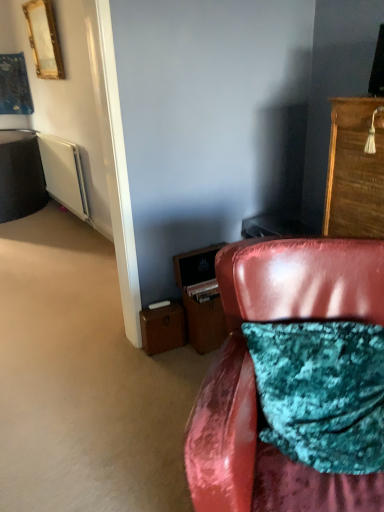
Question: Based on their sizes in the image, would you say gold-framed mirror at upper left is bigger or smaller than brown leather file cabinet at lower center?

Choices:
 (A) big
 (B) small

Answer: (B)

Question: Is gold-framed mirror at upper left inside or outside of brown leather file cabinet at lower center?

Choices:
 (A) outside
 (B) inside

Answer: (A)

Question: Estimate the real-world distances between objects in this image. Which object is farther from the white matte radiator at left?

Choices:
 (A) wooden drawer at lower center, which is counted as the second drawer, starting from the left
 (B) wooden cabinet at upper right
 (C) brown leather file cabinet at lower center
 (D) leather at lower right
 (E) brown leather suitcase at lower left, acting as the 2th drawer starting from the right

Answer: (D)

Question: Based on their relative distances, which object is farther from the brown leather file cabinet at lower center?

Choices:
 (A) brown leather suitcase at lower left, acting as the 2th drawer starting from the right
 (B) gold-framed mirror at upper left
 (C) wooden drawer at lower center, marked as the 1th drawer in a right-to-left arrangement
 (D) white matte radiator at left
 (E) leather at lower right

Answer: (B)